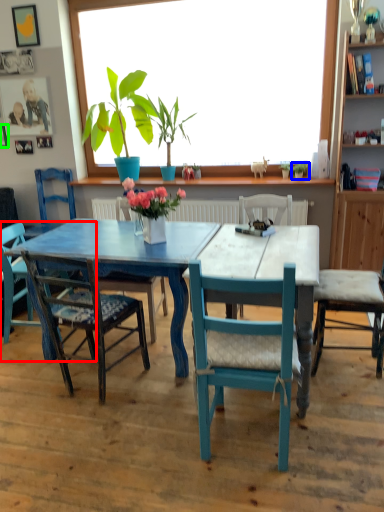
Question: Based on their relative distances, which object is farther from chair (highlighted by a red box)? Choose from houseplant (highlighted by a blue box) and picture frame (highlighted by a green box).

Choices:
 (A) houseplant
 (B) picture frame

Answer: (A)